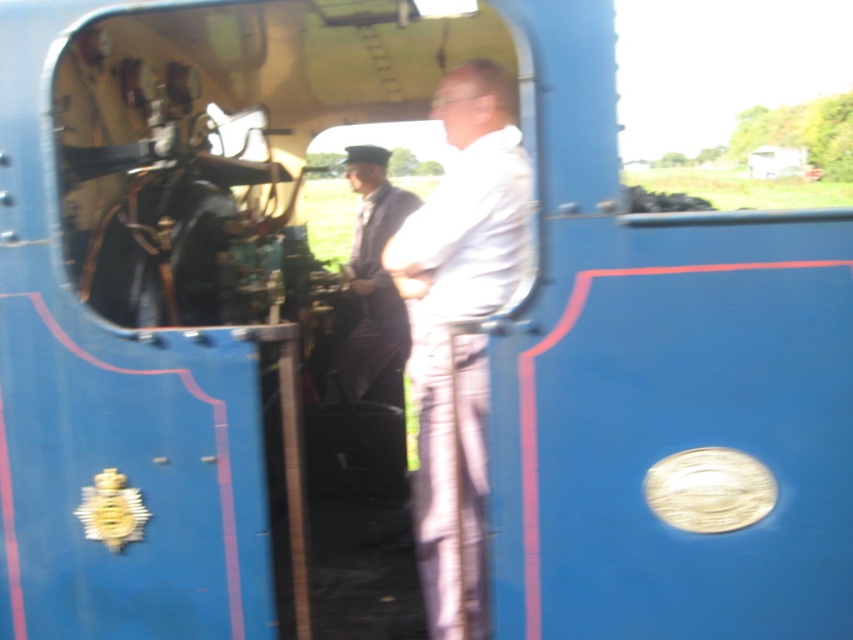
Question: Which point is farther to the camera?

Choices:
 (A) dark blue uniform at center
 (B) white matte shirt at center

Answer: (A)

Question: Does white matte shirt at center appear over dark blue uniform at center?

Choices:
 (A) no
 (B) yes

Answer: (A)

Question: Where is white matte shirt at center located in relation to dark blue uniform at center in the image?

Choices:
 (A) left
 (B) right

Answer: (B)

Question: Among these objects, which one is nearest to the camera?

Choices:
 (A) white matte shirt at center
 (B) dark blue uniform at center

Answer: (A)

Question: Which point is farther to the camera?

Choices:
 (A) click(x=373, y=310)
 (B) click(x=486, y=208)

Answer: (A)

Question: Can you confirm if white matte shirt at center is thinner than dark blue uniform at center?

Choices:
 (A) no
 (B) yes

Answer: (B)